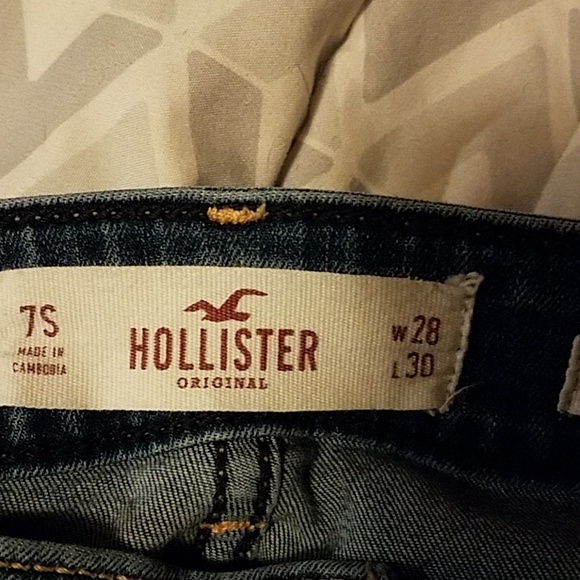
Where is `fabric`? The height and width of the screenshot is (580, 580). fabric is located at coordinates (398, 489).